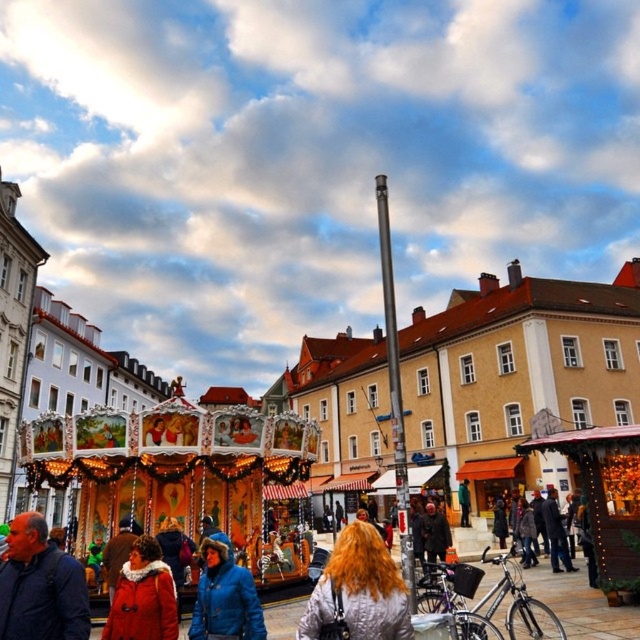
Does dark blue jacket at lower left have a lesser width compared to matte red coat at lower left?

No, dark blue jacket at lower left is not thinner than matte red coat at lower left.

This screenshot has height=640, width=640. Describe the element at coordinates (40, 586) in the screenshot. I see `dark blue jacket at lower left` at that location.

Where is `dark blue jacket at lower left`? dark blue jacket at lower left is located at coordinates (40, 586).

Who is more forward, (68, 636) or (365, 588)?

Point (68, 636) is in front.

Find the location of `dark blue jacket at lower left`. dark blue jacket at lower left is located at coordinates (40, 586).

Who is lower down, silky red hair at center or matte red coat at lower left?

silky red hair at center is below.

Who is taller, silky red hair at center or matte red coat at lower left?

silky red hair at center

Is point (376, 604) in front of point (164, 593)?

Yes, point (376, 604) is closer to viewer.

This screenshot has height=640, width=640. Find the location of `silky red hair at center`. silky red hair at center is located at coordinates (358, 589).